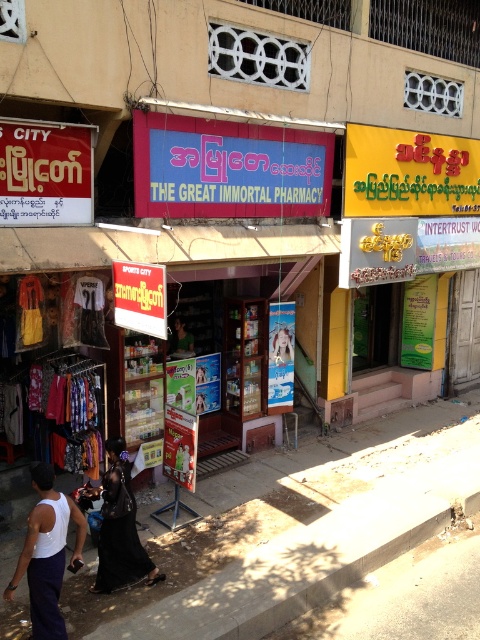
Question: Among these points, which one is nearest to the camera?

Choices:
 (A) (191, 336)
 (B) (231, 124)
 (C) (45, 577)
 (D) (106, 584)

Answer: (C)

Question: Is blue matte sign at center to the left of white fabric tank top at lower left from the viewer's perspective?

Choices:
 (A) no
 (B) yes

Answer: (A)

Question: Which point is closer to the camera taking this photo?

Choices:
 (A) [57, 636]
 (B) [168, 116]
 (C) [116, 484]

Answer: (A)

Question: Among these objects, which one is farthest from the camera?

Choices:
 (A) white fabric tank top at lower left
 (B) matte black shirt at center

Answer: (B)

Question: Is white fabric tank top at lower left bigger than matte black shirt at center?

Choices:
 (A) yes
 (B) no

Answer: (A)

Question: Can you confirm if black leather dress at lower center is positioned to the right of matte black shirt at center?

Choices:
 (A) yes
 (B) no

Answer: (B)